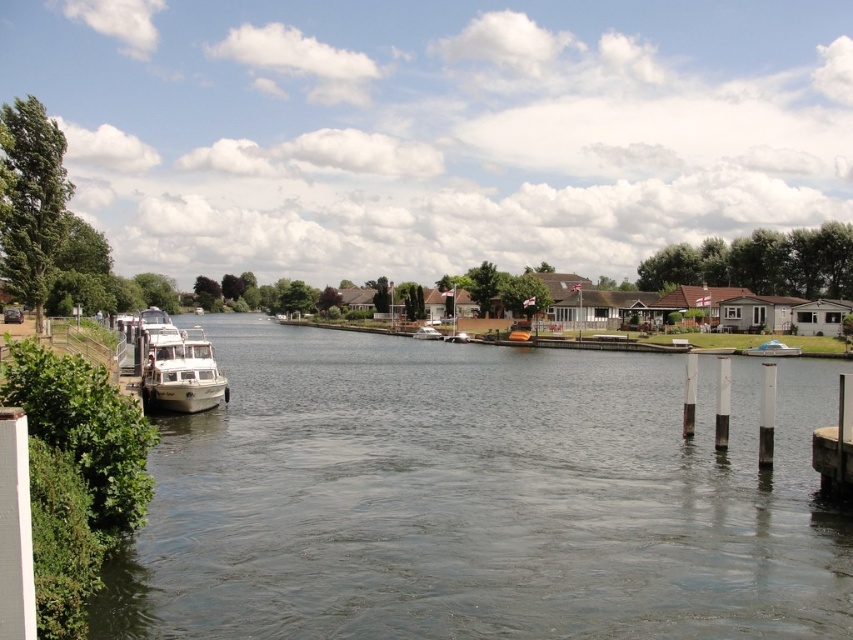
Question: From the image, what is the correct spatial relationship of clear water at left in relation to white glossy boat at left?

Choices:
 (A) above
 (B) below

Answer: (B)

Question: Considering the relative positions of blue glossy car at center and white glossy boat at center in the image provided, where is blue glossy car at center located with respect to white glossy boat at center?

Choices:
 (A) above
 (B) below

Answer: (B)

Question: Which of these objects is positioned closest to the blue glossy car at center?

Choices:
 (A) white glossy boat at center
 (B) clear water at left
 (C) white glossy boat at left

Answer: (B)

Question: Which is nearer to the clear water at left?

Choices:
 (A) white glossy boat at left
 (B) blue glossy car at center
 (C) white glossy boat at center

Answer: (A)

Question: Can you confirm if clear water at left is positioned to the right of white glossy boat at left?

Choices:
 (A) yes
 (B) no

Answer: (A)

Question: Which object is the closest to the blue glossy car at center?

Choices:
 (A) white glossy boat at left
 (B) white glossy boat at center
 (C) clear water at left

Answer: (C)